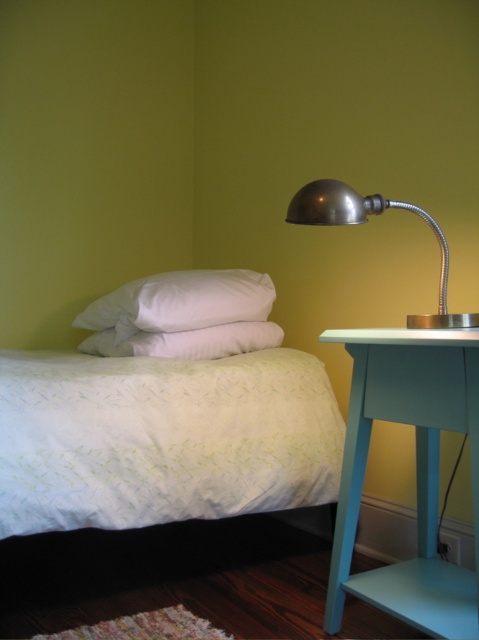
Question: Among these points, which one is farthest from the camera?

Choices:
 (A) (120, 291)
 (B) (203, 337)

Answer: (A)

Question: Based on their relative distances, which object is nearer to the white soft pillow at center?

Choices:
 (A) white textured blanket at lower left
 (B) white soft pillow at upper left
 (C) teal painted wood side table at right

Answer: (B)

Question: Which point appears farthest from the camera in this image?

Choices:
 (A) (244, 278)
 (B) (431, 404)

Answer: (A)

Question: Is teal painted wood side table at right wider than white soft pillow at center?

Choices:
 (A) yes
 (B) no

Answer: (B)

Question: In this image, where is white soft pillow at upper left located relative to white soft pillow at center?

Choices:
 (A) below
 (B) above

Answer: (B)

Question: Can you confirm if white soft pillow at upper left is positioned to the left of white soft pillow at center?

Choices:
 (A) yes
 (B) no

Answer: (A)